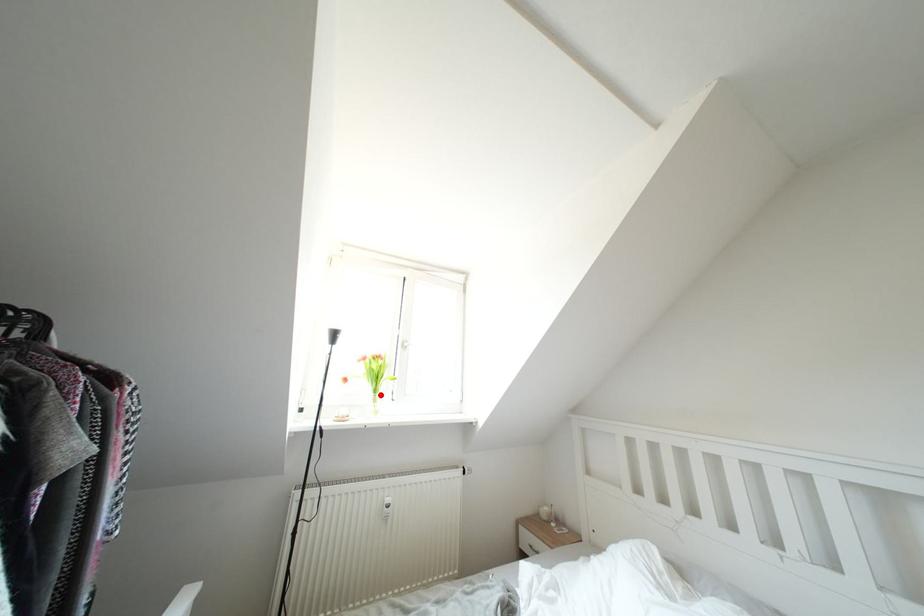
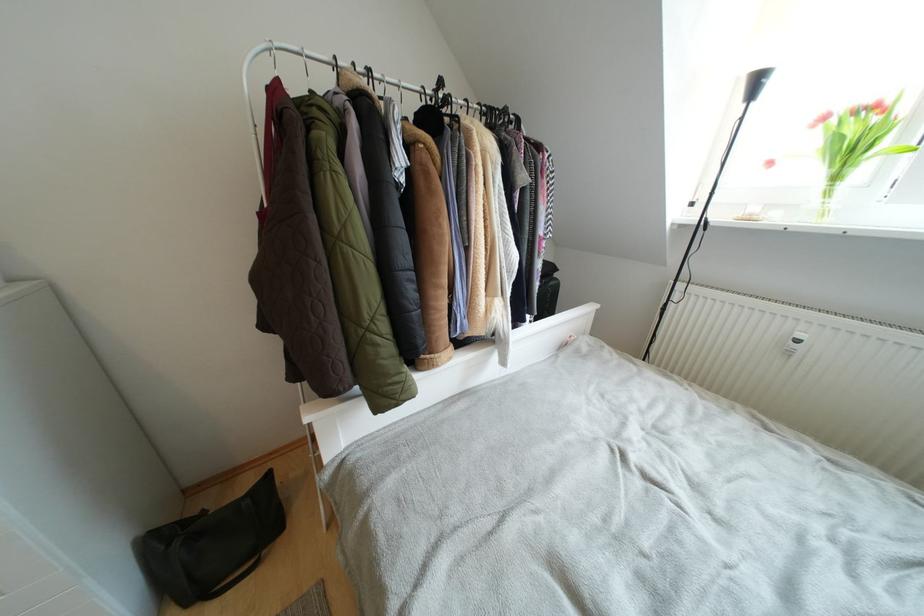
The point at the highlighted location is marked in the first image. Where is the corresponding point in the second image?

(840, 182)